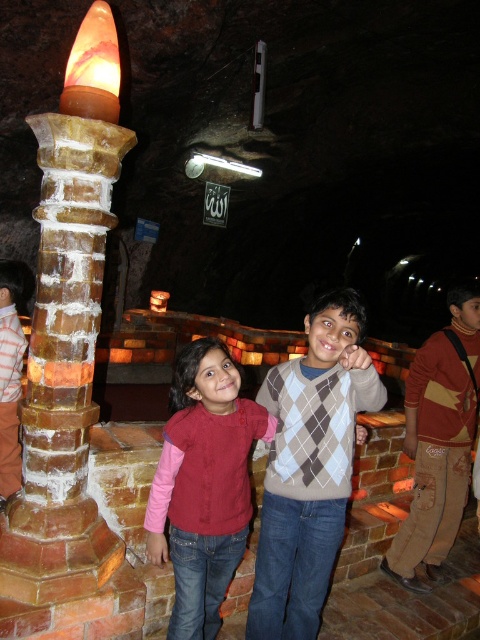
Between sandy stone pillar at left and brown cotton pants at lower right, which one has more height?

sandy stone pillar at left is taller.

Describe the element at coordinates (68, 332) in the screenshot. Image resolution: width=480 pixels, height=640 pixels. I see `sandy stone pillar at left` at that location.

The height and width of the screenshot is (640, 480). Identify the location of sandy stone pillar at left. (68, 332).

Does argyle sweater at center appear under velvet pink sweater at center?

No.

Does argyle sweater at center have a larger size compared to velvet pink sweater at center?

Correct, argyle sweater at center is larger in size than velvet pink sweater at center.

Identify the location of argyle sweater at center. (310, 467).

Which is behind, point (32, 122) or point (345, 452)?

The point (345, 452) is behind.

Measure the distance between point (58, 406) and camera.

Point (58, 406) is 8.44 feet from camera.

You are a GUI agent. You are given a task and a screenshot of the screen. Output one action in this format:
    pyautogui.click(x=<x>, y=<y>)
    Task: Click on the sandy stone pillar at left
    The image size is (480, 640).
    Given the screenshot: What is the action you would take?
    pyautogui.click(x=68, y=332)